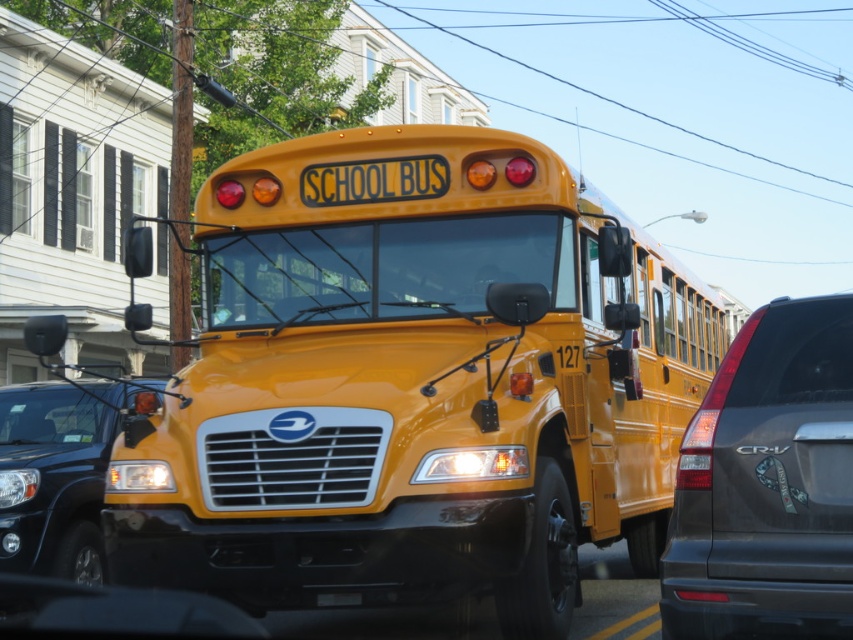
Question: Does glossy black suv at left have a smaller size compared to yellow matte license plate at center?

Choices:
 (A) yes
 (B) no

Answer: (B)

Question: Which point is farther to the camera?

Choices:
 (A) yellow matte license plate at center
 (B) matte black suv at right
 (C) yellow matte/solid school bus at center
 (D) glossy black suv at left

Answer: (D)

Question: Considering the relative positions of yellow matte/solid school bus at center and glossy black suv at left in the image provided, where is yellow matte/solid school bus at center located with respect to glossy black suv at left?

Choices:
 (A) right
 (B) left

Answer: (A)

Question: Which of the following is the closest to the observer?

Choices:
 (A) (82, 490)
 (B) (727, 419)
 (C) (430, 579)

Answer: (B)

Question: Observing the image, what is the correct spatial positioning of matte black suv at right in reference to yellow matte license plate at center?

Choices:
 (A) left
 (B) right

Answer: (B)

Question: Which of the following is the farthest from the observer?

Choices:
 (A) (242, 220)
 (B) (28, 563)
 (C) (351, 604)
 (D) (822, 412)

Answer: (A)